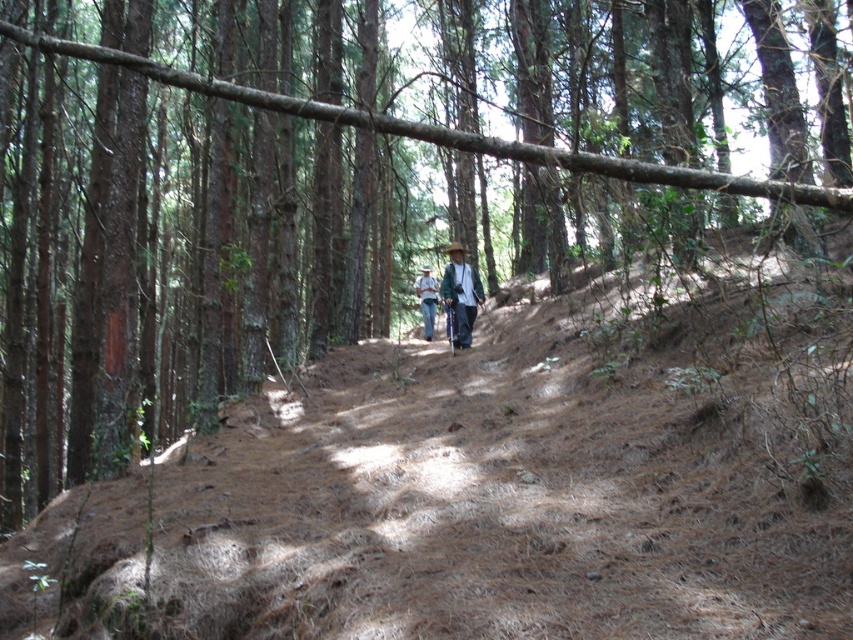
Between wooden walking stick at center and camouflage fabric shirt at center, which one appears on the right side from the viewer's perspective?

wooden walking stick at center

Between point (453, 300) and point (430, 333), which one is positioned in front?

Point (453, 300) is in front.

Is point (456, 292) less distant than point (425, 308)?

Yes, it is.

Where is `wooden walking stick at center`? wooden walking stick at center is located at coordinates (x=461, y=292).